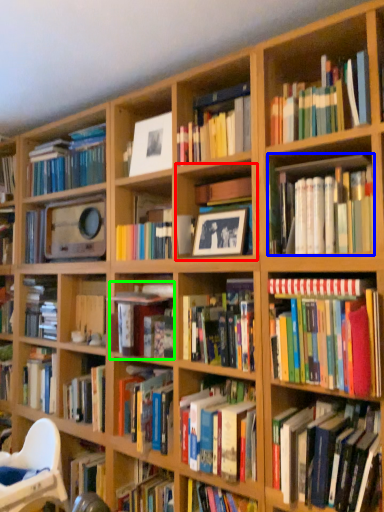
Question: Based on their relative distances, which object is farther from cabinet (highlighted by a red box)? Choose from book (highlighted by a blue box) and book (highlighted by a green box).

Choices:
 (A) book
 (B) book

Answer: (B)